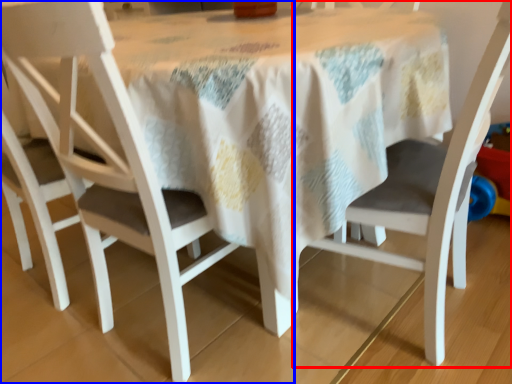
Question: Which object appears farthest to the camera in this image, chair (highlighted by a red box) or chair (highlighted by a blue box)?

Choices:
 (A) chair
 (B) chair

Answer: (B)